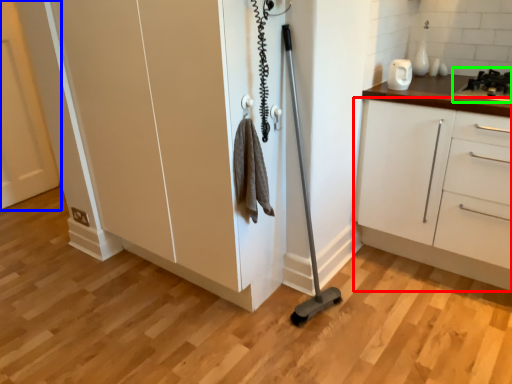
Question: Considering the real-world distances, which object is closest to cabinetry (highlighted by a red box)? door (highlighted by a blue box) or gas stove (highlighted by a green box).

Choices:
 (A) door
 (B) gas stove

Answer: (B)